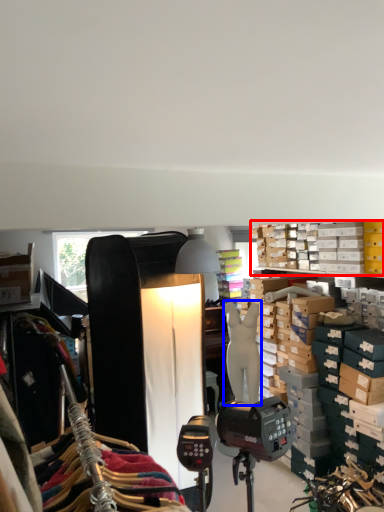
Question: Among these objects, which one is farthest to the camera, shelf (highlighted by a red box) or mannequin (highlighted by a blue box)?

Choices:
 (A) shelf
 (B) mannequin

Answer: (B)